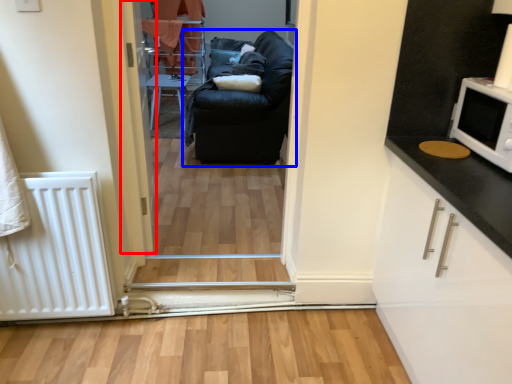
Question: Among these objects, which one is nearest to the camera, door (highlighted by a red box) or studio couch (highlighted by a blue box)?

Choices:
 (A) door
 (B) studio couch

Answer: (A)